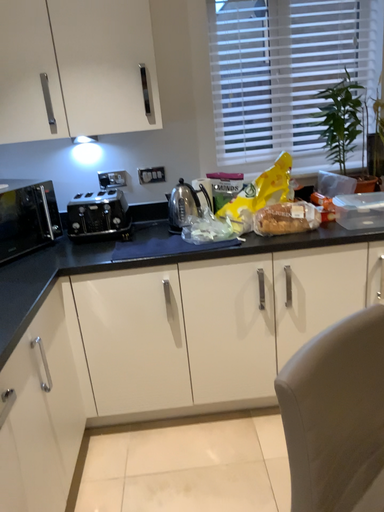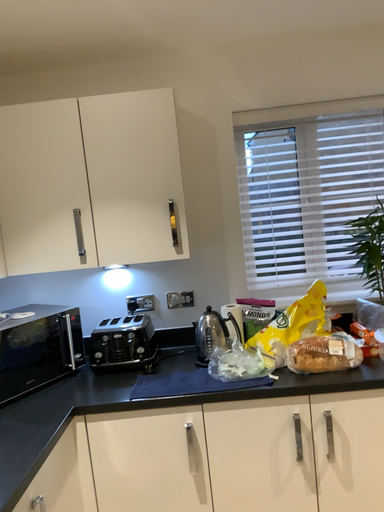
Question: Which way did the camera rotate in the video?

Choices:
 (A) rotated upward
 (B) rotated downward

Answer: (A)